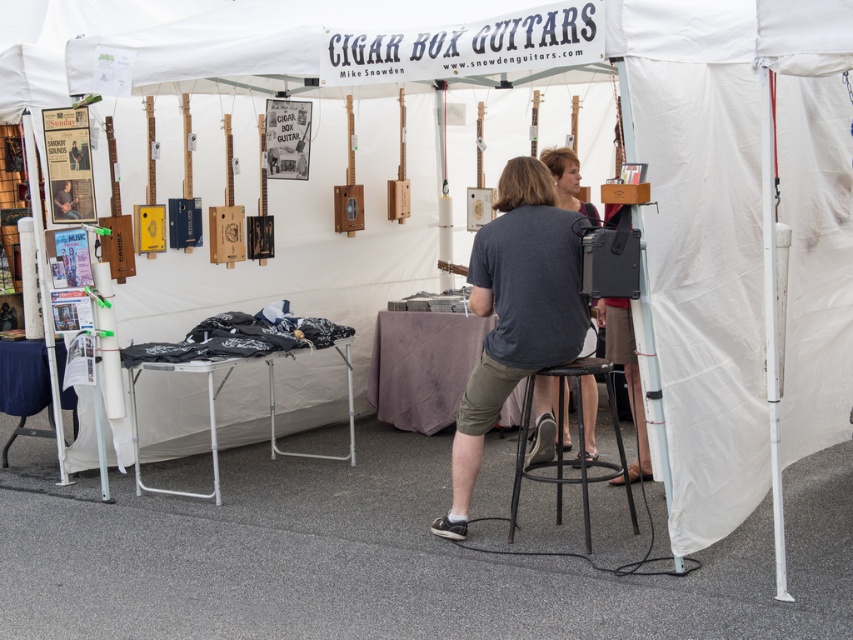
Question: Which point is closer to the camera taking this photo?

Choices:
 (A) pyautogui.click(x=24, y=358)
 (B) pyautogui.click(x=585, y=465)
 (C) pyautogui.click(x=368, y=376)

Answer: (B)

Question: Is dark gray t-shirt at center to the right of blue fabric table at lower left from the viewer's perspective?

Choices:
 (A) no
 (B) yes

Answer: (B)

Question: Which of the following is the closest to the observer?

Choices:
 (A) (625, 385)
 (B) (630, 506)
 (C) (577, 330)
 (D) (213, 474)

Answer: (C)

Question: Which of the following is the closest to the observer?

Choices:
 (A) purple fabric-covered table at center
 (B) matte black speaker at center

Answer: (B)

Question: Can you confirm if purple fabric-covered table at center is thinner than matte black speaker at center?

Choices:
 (A) no
 (B) yes

Answer: (A)

Question: Observing the image, what is the correct spatial positioning of dark gray t-shirt at center in reference to metallic silver table at center?

Choices:
 (A) left
 (B) right

Answer: (B)